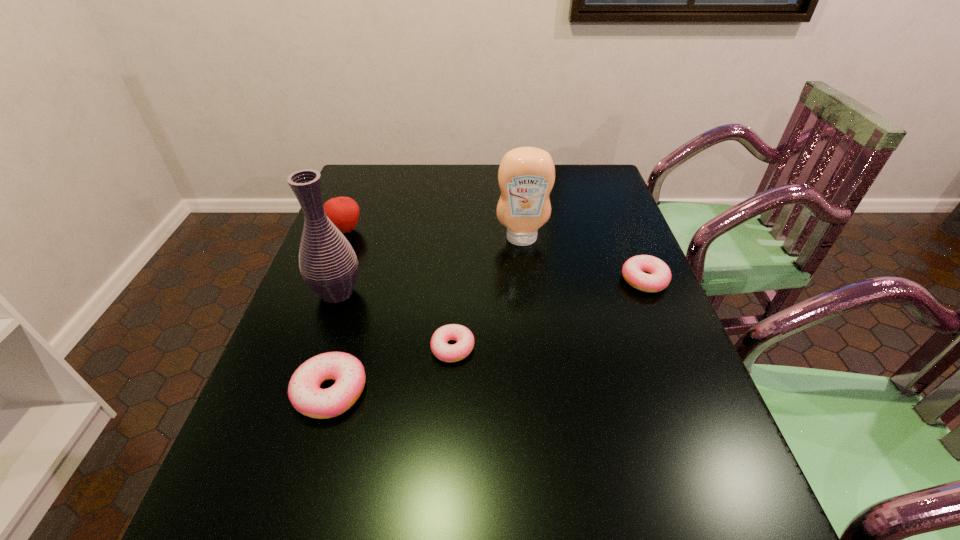
At what (x,y) coordinates should I click in order to perform the action: click on free space at the far edge. Please return your answer as a coordinate pair (x, y). Looking at the image, I should click on (449, 180).

The image size is (960, 540). I want to click on free space at the left edge of the desktop, so click(343, 310).

Identify the location of vacant area at the right edge. (618, 302).

Locate an element on the screen. The image size is (960, 540). free space at the far left corner of the desktop is located at coordinates (360, 193).

Find the location of a particular element. The height and width of the screenshot is (540, 960). free space at the far right corner is located at coordinates (588, 193).

Locate an element on the screen. Image resolution: width=960 pixels, height=540 pixels. vacant space that's between the second tallest object and the shortest object is located at coordinates (488, 293).

This screenshot has height=540, width=960. I want to click on vacant point located between the tallest doughnut and the tallest object, so pos(334,342).

Where is `free space between the fifth tallest object and the leftmost doughnut`? free space between the fifth tallest object and the leftmost doughnut is located at coordinates (488, 336).

Where is `unoccupied area between the leftmost doughnut and the tallest object`? The image size is (960, 540). unoccupied area between the leftmost doughnut and the tallest object is located at coordinates (334, 342).

Find the location of a particular element. Image resolution: width=960 pixels, height=540 pixels. free area in between the tallest object and the fourth object from left to right is located at coordinates coord(395,320).